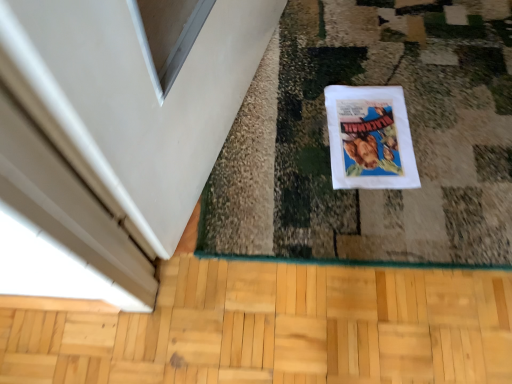
Question: Considering their positions, is white paper comic book at center located in front of or behind light brown wood flooring at lower center?

Choices:
 (A) behind
 (B) front

Answer: (A)

Question: From the image's perspective, relative to light brown wood flooring at lower center, is white paper comic book at center above or below?

Choices:
 (A) below
 (B) above

Answer: (B)

Question: Considering the positions of point (374, 180) and point (497, 273), is point (374, 180) closer or farther from the camera than point (497, 273)?

Choices:
 (A) farther
 (B) closer

Answer: (A)

Question: Is light brown wood flooring at lower center bigger or smaller than white paper comic book at center?

Choices:
 (A) small
 (B) big

Answer: (B)

Question: From a real-world perspective, relative to white paper comic book at center, is light brown wood flooring at lower center vertically above or below?

Choices:
 (A) above
 (B) below

Answer: (B)

Question: Considering their positions, is light brown wood flooring at lower center located in front of or behind white paper comic book at center?

Choices:
 (A) front
 (B) behind

Answer: (A)

Question: Considering the positions of light brown wood flooring at lower center and white paper comic book at center in the image, is light brown wood flooring at lower center taller or shorter than white paper comic book at center?

Choices:
 (A) tall
 (B) short

Answer: (A)